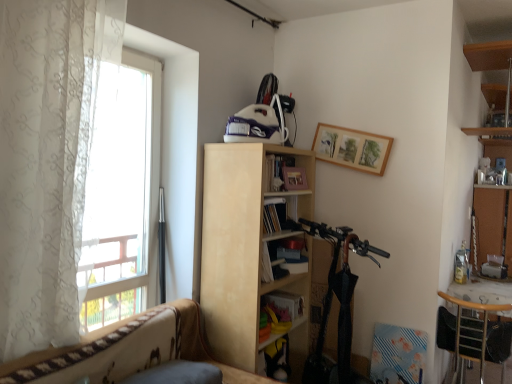
Question: Considering the relative sizes of wooden chair at lower right and hardcover book at center, which is the second book from bottom to top, in the image provided, is wooden chair at lower right thinner than hardcover book at center, which is the second book from bottom to top,?

Choices:
 (A) yes
 (B) no

Answer: (B)

Question: Is wooden chair at lower right to the left of hardcover book at center, the 1th book in the top-to-bottom sequence, from the viewer's perspective?

Choices:
 (A) yes
 (B) no

Answer: (B)

Question: Can you confirm if wooden chair at lower right is positioned to the right of hardcover book at center, which is the second book from bottom to top?

Choices:
 (A) yes
 (B) no

Answer: (A)

Question: Is wooden chair at lower right beside hardcover book at center, which is the second book from bottom to top?

Choices:
 (A) yes
 (B) no

Answer: (B)

Question: Does wooden chair at lower right come behind hardcover book at center, the 1th book in the top-to-bottom sequence?

Choices:
 (A) no
 (B) yes

Answer: (A)

Question: Looking at the image, does bare wood cabinet at right seem bigger or smaller compared to patterned fabric couch at lower left?

Choices:
 (A) small
 (B) big

Answer: (A)

Question: Considering their positions, is bare wood cabinet at right located in front of or behind patterned fabric couch at lower left?

Choices:
 (A) behind
 (B) front

Answer: (A)

Question: From a real-world perspective, is bare wood cabinet at right above or below patterned fabric couch at lower left?

Choices:
 (A) above
 (B) below

Answer: (A)

Question: Is point (480, 203) positioned closer to the camera than point (113, 337)?

Choices:
 (A) farther
 (B) closer

Answer: (A)

Question: Looking at their shapes, would you say wooden picture frame at upper center is wider or thinner than matte yellow book at center, positioned as the first book in bottom-to-top order?

Choices:
 (A) wide
 (B) thin

Answer: (B)

Question: In terms of size, does wooden picture frame at upper center appear bigger or smaller than matte yellow book at center, positioned as the first book in bottom-to-top order?

Choices:
 (A) big
 (B) small

Answer: (A)

Question: From the image's perspective, is wooden picture frame at upper center positioned above or below matte yellow book at center, placed as the second book when sorted from top to bottom?

Choices:
 (A) below
 (B) above

Answer: (B)

Question: Is point (332, 140) closer or farther from the camera than point (288, 311)?

Choices:
 (A) farther
 (B) closer

Answer: (A)

Question: In terms of size, does wooden chair at lower right appear bigger or smaller than matte yellow book at center, positioned as the first book in bottom-to-top order?

Choices:
 (A) big
 (B) small

Answer: (A)

Question: Which is correct: wooden chair at lower right is inside matte yellow book at center, positioned as the first book in bottom-to-top order, or outside of it?

Choices:
 (A) inside
 (B) outside

Answer: (B)